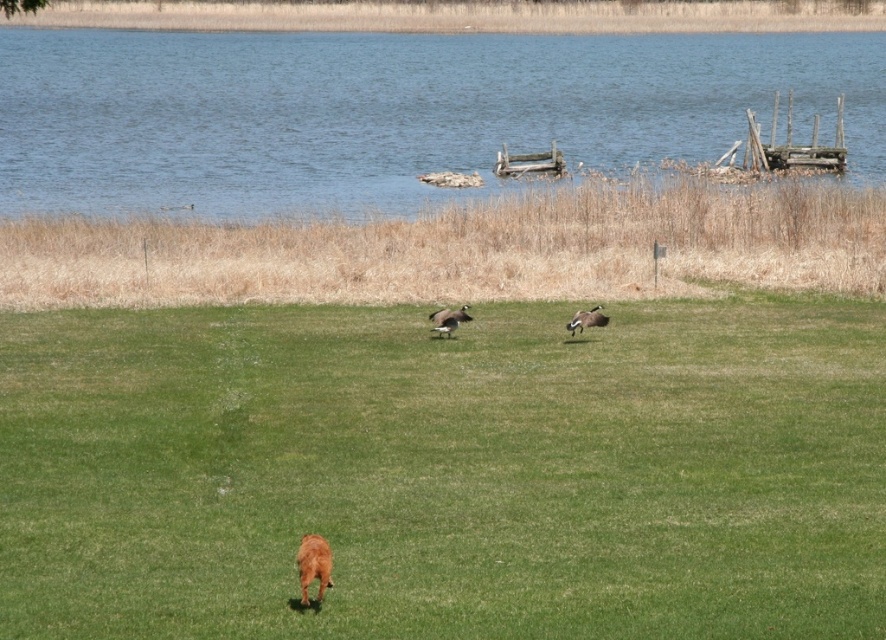
Can you confirm if brown furry dog at lower center is taller than brown glossy duck at center?

Yes, brown furry dog at lower center is taller than brown glossy duck at center.

Is brown furry dog at lower center below brown glossy duck at center?

Yes.

Is point (300, 554) positioned in front of point (580, 316)?

Yes, it is in front of point (580, 316).

The height and width of the screenshot is (640, 886). Find the location of `brown furry dog at lower center`. brown furry dog at lower center is located at coordinates (313, 564).

Is point (21, 604) farther from viewer compared to point (574, 317)?

No, (21, 604) is in front of (574, 317).

Is point (462, 413) less distant than point (572, 330)?

Yes, point (462, 413) is closer to viewer.

Identify the location of green grassy field at center. (445, 472).

Is green grassy field at center bigger than blue water at upper center?

Incorrect, green grassy field at center is not larger than blue water at upper center.

Is green grassy field at center closer to camera compared to blue water at upper center?

Yes, it is in front of blue water at upper center.

Where is `green grassy field at center`? green grassy field at center is located at coordinates (445, 472).

In order to click on green grassy field at center in this screenshot , I will do 445,472.